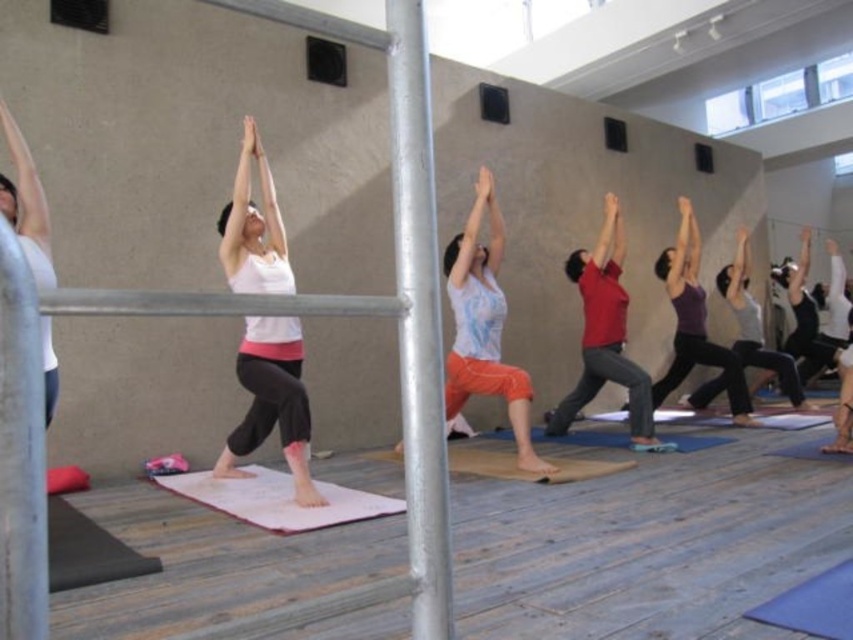
Question: Is the position of matte white tank top at center more distant than that of brown textured yoga mat at center?

Choices:
 (A) no
 (B) yes

Answer: (A)

Question: Among these objects, which one is farthest from the camera?

Choices:
 (A) white matte tank top at left
 (B) pink fabric yoga mat at center
 (C) purple matte leggings at center
 (D) light blue cotton shirt at center

Answer: (C)

Question: Is matte white tank top at center below brown textured yoga mat at center?

Choices:
 (A) yes
 (B) no

Answer: (B)

Question: Which point is farther to the camera?

Choices:
 (A) pink fabric yoga mat at center
 (B) matte white tank top at center

Answer: (B)

Question: Which point is closer to the camera?

Choices:
 (A) light blue cotton shirt at center
 (B) matte white tank top at center
 (C) purple matte tank top at center
 (D) white matte tank top at left

Answer: (D)

Question: Is light blue cotton shirt at center to the left of matte red shirt at center from the viewer's perspective?

Choices:
 (A) no
 (B) yes

Answer: (B)